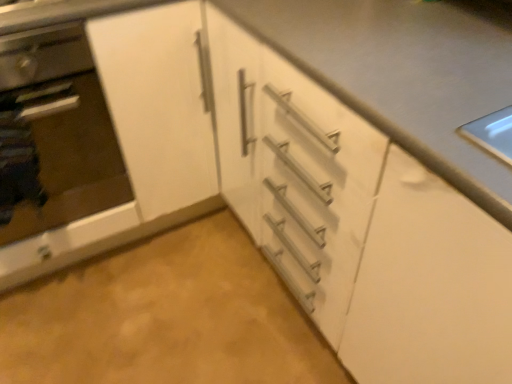
Question: Is white matte cabinet at center wider than satin silver oven at left?

Choices:
 (A) no
 (B) yes

Answer: (B)

Question: Is white matte cabinet at center oriented away from satin silver oven at left?

Choices:
 (A) no
 (B) yes

Answer: (A)

Question: From the image's perspective, is white matte cabinet at center over satin silver oven at left?

Choices:
 (A) no
 (B) yes

Answer: (B)

Question: Is white matte cabinet at center to the left of satin silver oven at left from the viewer's perspective?

Choices:
 (A) yes
 (B) no

Answer: (B)

Question: Can you confirm if white matte cabinet at center is thinner than satin silver oven at left?

Choices:
 (A) yes
 (B) no

Answer: (B)

Question: Is white matte cabinet at center positioned behind satin silver oven at left?

Choices:
 (A) yes
 (B) no

Answer: (A)

Question: Considering the relative positions of white matte countertop at center and white matte cabinet at center in the image provided, is white matte countertop at center to the right of white matte cabinet at center from the viewer's perspective?

Choices:
 (A) yes
 (B) no

Answer: (A)

Question: From the image's perspective, is white matte countertop at center below white matte cabinet at center?

Choices:
 (A) yes
 (B) no

Answer: (A)

Question: From the image's perspective, does white matte countertop at center appear higher than white matte cabinet at center?

Choices:
 (A) yes
 (B) no

Answer: (B)

Question: Is white matte countertop at center next to white matte cabinet at center?

Choices:
 (A) no
 (B) yes

Answer: (A)

Question: Does white matte countertop at center have a lesser height compared to white matte cabinet at center?

Choices:
 (A) no
 (B) yes

Answer: (A)

Question: Is white matte countertop at center wider than white matte cabinet at center?

Choices:
 (A) no
 (B) yes

Answer: (B)

Question: Considering the relative positions of white matte countertop at center and satin silver oven at left in the image provided, is white matte countertop at center in front of satin silver oven at left?

Choices:
 (A) yes
 (B) no

Answer: (A)